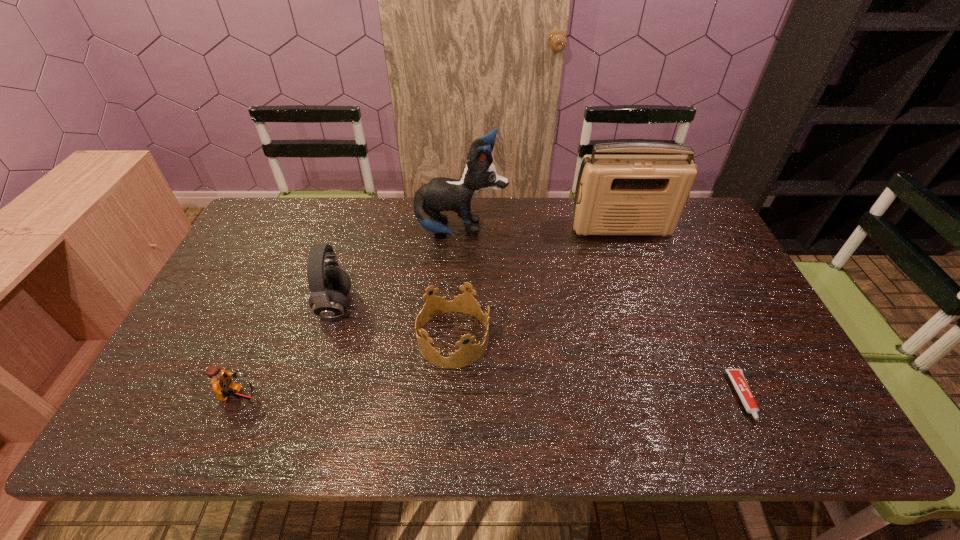
I want to click on blank area in the image that satisfies the following two spatial constraints: 1. on the front-facing side of the radio receiver; 2. on the front-facing side of the tiara, so click(660, 339).

You are a GUI agent. You are given a task and a screenshot of the screen. Output one action in this format:
    pyautogui.click(x=<x>, y=<y>)
    Task: Click on the free spot that satisfies the following two spatial constraints: 1. on the front-facing side of the radio receiver; 2. on the ear cups of the fourth shortest object
    
    Given the screenshot: What is the action you would take?
    (x=649, y=306)

The height and width of the screenshot is (540, 960). I want to click on vacant space that satisfies the following two spatial constraints: 1. on the front-facing side of the radio receiver; 2. on the front-facing side of the tiara, so pos(660,339).

The image size is (960, 540). Identify the location of free location that satisfies the following two spatial constraints: 1. on the front-facing side of the radio receiver; 2. holding a crossbow in the hands of the Lego. tap(683, 399).

Locate an element on the screen. The image size is (960, 540). vacant area that satisfies the following two spatial constraints: 1. on the front-facing side of the radio receiver; 2. on the front-facing side of the puppy is located at coordinates (622, 231).